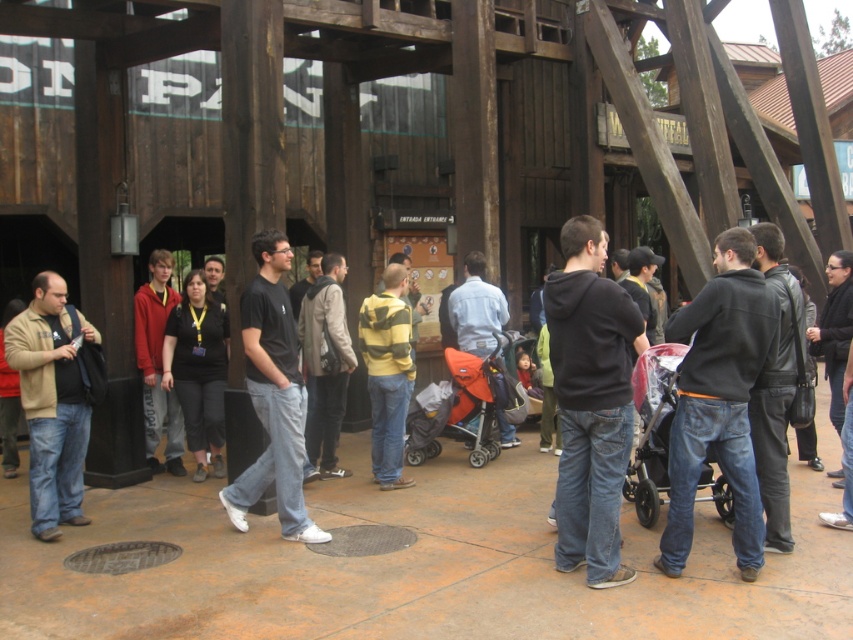
Question: Which point appears farthest from the camera in this image?

Choices:
 (A) (750, 548)
 (B) (463, 291)
 (C) (624, 468)

Answer: (B)

Question: Can you confirm if black leather jacket at right is bigger than dark gray leather jacket at center?

Choices:
 (A) no
 (B) yes

Answer: (A)

Question: Can you confirm if black cotton shirt at center is wider than dark gray leather jacket at center?

Choices:
 (A) yes
 (B) no

Answer: (A)

Question: Which object is the farthest from the matte red hoodie at center?

Choices:
 (A) matte brown jacket at left
 (B) striped hoodie at center
 (C) black leather jacket at right

Answer: (C)

Question: Does transparent plastic baby carriage at center come in front of yellow striped sweater at center?

Choices:
 (A) yes
 (B) no

Answer: (A)

Question: Estimate the real-world distances between objects in this image. Which object is farther from the striped sweater at center?

Choices:
 (A) orange fabric stroller at center
 (B) matte red hoodie at center

Answer: (B)